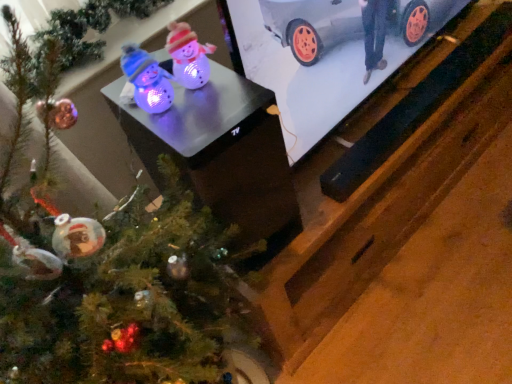
Question: Is matte plastic table at center with green matte christmas tree at lower left?

Choices:
 (A) no
 (B) yes

Answer: (A)

Question: Can you confirm if matte plastic table at center is wider than green matte christmas tree at lower left?

Choices:
 (A) no
 (B) yes

Answer: (A)

Question: From the image's perspective, is matte plastic table at center located above green matte christmas tree at lower left?

Choices:
 (A) no
 (B) yes

Answer: (B)

Question: Can you confirm if matte plastic table at center is positioned to the left of green matte christmas tree at lower left?

Choices:
 (A) no
 (B) yes

Answer: (A)

Question: Can you confirm if matte plastic table at center is smaller than green matte christmas tree at lower left?

Choices:
 (A) no
 (B) yes

Answer: (B)

Question: Is metallic silver car at upper right bigger or smaller than green matte christmas tree at lower left?

Choices:
 (A) small
 (B) big

Answer: (A)

Question: Is metallic silver car at upper right situated inside green matte christmas tree at lower left or outside?

Choices:
 (A) inside
 (B) outside

Answer: (B)

Question: From the image's perspective, is metallic silver car at upper right above or below green matte christmas tree at lower left?

Choices:
 (A) above
 (B) below

Answer: (A)

Question: From their relative heights in the image, would you say metallic silver car at upper right is taller or shorter than green matte christmas tree at lower left?

Choices:
 (A) short
 (B) tall

Answer: (A)

Question: Is point (396, 6) positioned closer to the camera than point (288, 220)?

Choices:
 (A) closer
 (B) farther

Answer: (B)

Question: Is metallic silver car at upper right to the left or to the right of matte plastic table at center in the image?

Choices:
 (A) right
 (B) left

Answer: (A)

Question: In terms of height, does metallic silver car at upper right look taller or shorter compared to matte plastic table at center?

Choices:
 (A) short
 (B) tall

Answer: (B)

Question: Based on their sizes in the image, would you say metallic silver car at upper right is bigger or smaller than matte plastic table at center?

Choices:
 (A) big
 (B) small

Answer: (A)

Question: Is green matte christmas tree at lower left to the left or to the right of matte plastic table at center in the image?

Choices:
 (A) right
 (B) left

Answer: (B)

Question: Considering their positions, is green matte christmas tree at lower left located in front of or behind matte plastic table at center?

Choices:
 (A) behind
 (B) front

Answer: (B)